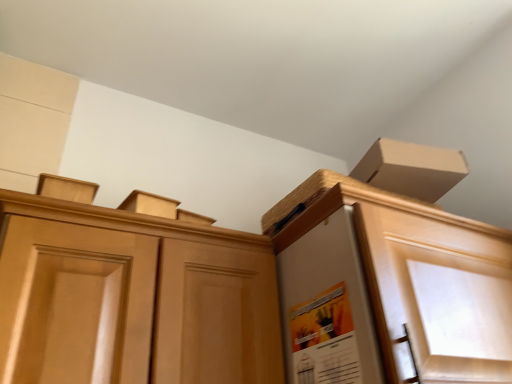
Image resolution: width=512 pixels, height=384 pixels. Describe the element at coordinates (253, 295) in the screenshot. I see `light brown wood cabinet at center` at that location.

Find the location of `light brown wood cabinet at center`. light brown wood cabinet at center is located at coordinates (253, 295).

Locate an element on the screen. This screenshot has width=512, height=384. matte orange poster at center is located at coordinates (324, 339).

This screenshot has width=512, height=384. Describe the element at coordinates (324, 339) in the screenshot. I see `matte orange poster at center` at that location.

The width and height of the screenshot is (512, 384). In order to click on light brown wood cabinet at center in this screenshot , I will do `click(253, 295)`.

Based on their positions, is matte orange poster at center located to the left or right of light brown wood cabinet at center?

Clearly, matte orange poster at center is on the right of light brown wood cabinet at center in the image.

Considering the positions of objects matte orange poster at center and light brown wood cabinet at center in the image provided, who is in front, matte orange poster at center or light brown wood cabinet at center?

light brown wood cabinet at center is in front.

Is point (347, 367) behind point (376, 221)?

That is False.

From the image's perspective, is matte orange poster at center located above light brown wood cabinet at center?

No, from the image's perspective, matte orange poster at center is not on top of light brown wood cabinet at center.

From a real-world perspective, is matte orange poster at center above or below light brown wood cabinet at center?

matte orange poster at center is situated lower than light brown wood cabinet at center in the real world.

Looking at their sizes, would you say matte orange poster at center is wider or thinner than light brown wood cabinet at center?

In the image, matte orange poster at center appears to be more narrow than light brown wood cabinet at center.

Is matte orange poster at center shorter than light brown wood cabinet at center?

Yes, matte orange poster at center is shorter than light brown wood cabinet at center.

Looking at the image, does matte orange poster at center seem bigger or smaller compared to light brown wood cabinet at center?

matte orange poster at center is smaller than light brown wood cabinet at center.

Is matte orange poster at center positioned beyond the bounds of light brown wood cabinet at center?

matte orange poster at center lies outside light brown wood cabinet at center's area.

Does matte orange poster at center touch light brown wood cabinet at center?

matte orange poster at center is not next to light brown wood cabinet at center, and they're not touching.

Is matte orange poster at center facing away from light brown wood cabinet at center?

No, matte orange poster at center's orientation is not away from light brown wood cabinet at center.

At what (x,y) coordinates should I click in order to perform the action: click on poster behind the light brown wood cabinet at center. Please return your answer as a coordinate pair (x, y). The height and width of the screenshot is (384, 512). Looking at the image, I should click on (324, 339).

Would you say light brown wood cabinet at center is to the left or to the right of matte orange poster at center in the picture?

Clearly, light brown wood cabinet at center is on the left of matte orange poster at center in the image.

Is light brown wood cabinet at center further to camera compared to matte orange poster at center?

No, the depth of light brown wood cabinet at center is less than that of matte orange poster at center.

Between point (320, 290) and point (304, 362), which one is positioned behind?

The point (320, 290) is farther from the camera.

From the image's perspective, is light brown wood cabinet at center on top of matte orange poster at center?

Yes, from the image's perspective, light brown wood cabinet at center is above matte orange poster at center.

From a real-world perspective, is light brown wood cabinet at center physically located above or below matte orange poster at center?

light brown wood cabinet at center is above matte orange poster at center.

Looking at their sizes, would you say light brown wood cabinet at center is wider or thinner than matte orange poster at center?

Clearly, light brown wood cabinet at center has more width compared to matte orange poster at center.

Which of these two, light brown wood cabinet at center or matte orange poster at center, stands shorter?

matte orange poster at center.

From the picture: Based on their sizes in the image, would you say light brown wood cabinet at center is bigger or smaller than matte orange poster at center?

light brown wood cabinet at center is bigger than matte orange poster at center.

Is light brown wood cabinet at center inside the boundaries of matte orange poster at center, or outside?

light brown wood cabinet at center cannot be found inside matte orange poster at center.

Would you say light brown wood cabinet at center is a long distance from matte orange poster at center?

They are positioned close to each other.

Is light brown wood cabinet at center facing away from matte orange poster at center?

No, light brown wood cabinet at center is not facing the opposite direction of matte orange poster at center.

Locate an element on the screen. This screenshot has height=384, width=512. cabinetry above the matte orange poster at center (from the image's perspective) is located at coordinates (253, 295).

The width and height of the screenshot is (512, 384). I want to click on poster that appears below the light brown wood cabinet at center (from a real-world perspective), so click(324, 339).

I want to click on poster behind the light brown wood cabinet at center, so click(x=324, y=339).